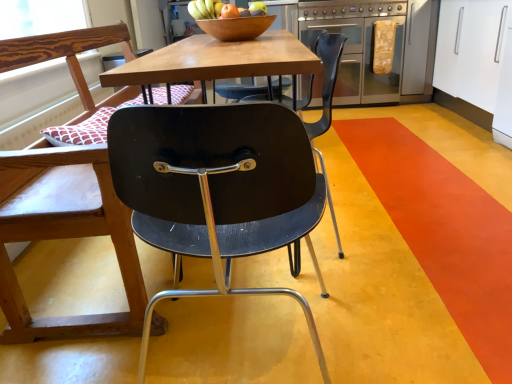
In order to click on free spot behind matte brown apple at center in this screenshot , I will do `click(224, 17)`.